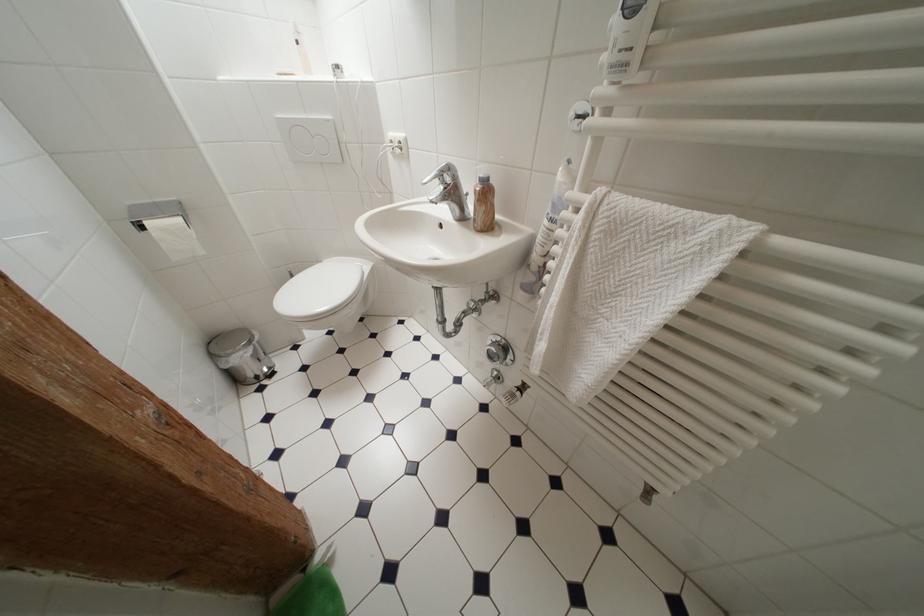
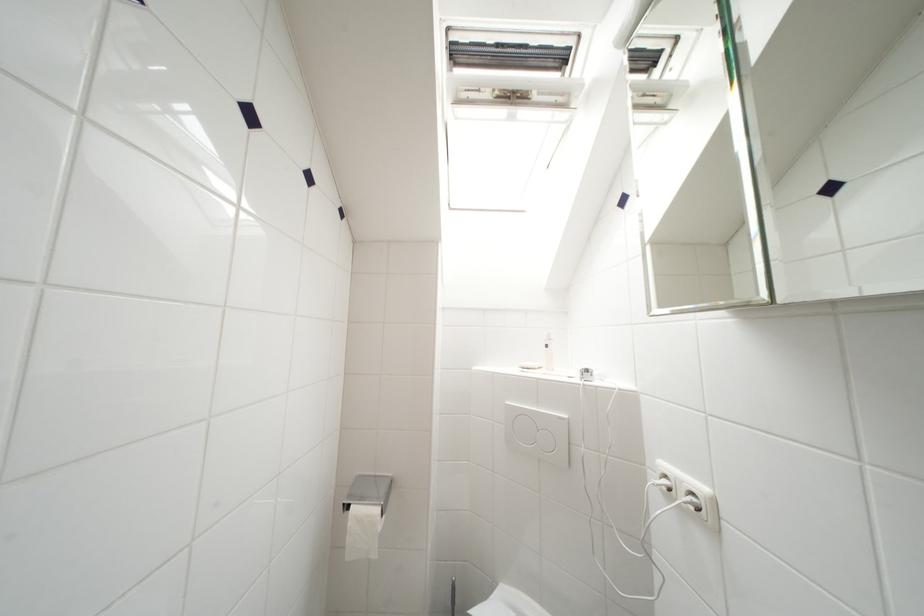
The point at (397, 145) is marked in the first image. Where is the corresponding point in the second image?

(672, 480)